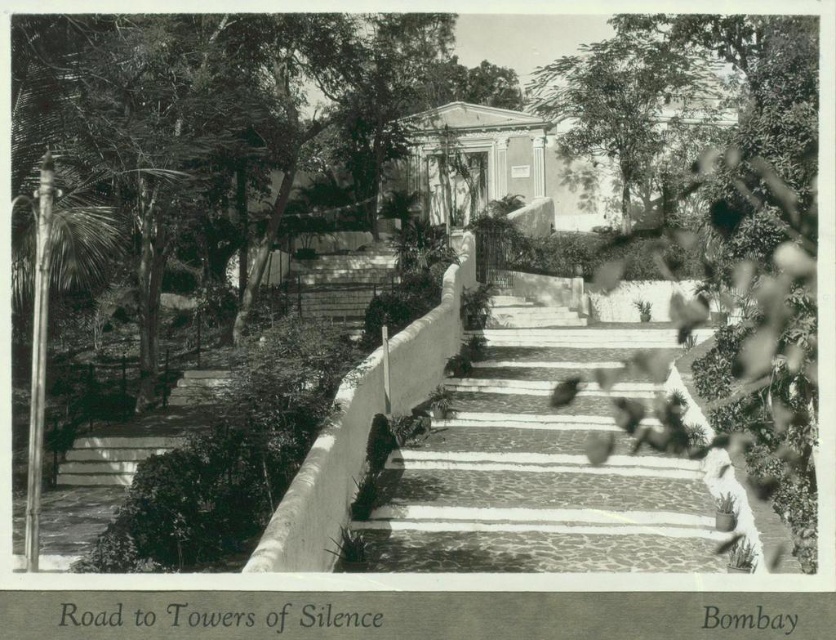
Who is positioned more to the left, smooth green leafy tree at center or marble stone steps at center?

smooth green leafy tree at center is more to the left.

Identify the location of smooth green leafy tree at center. The image size is (836, 640). (222, 116).

Locate an element on the screen. smooth green leafy tree at center is located at coordinates (222, 116).